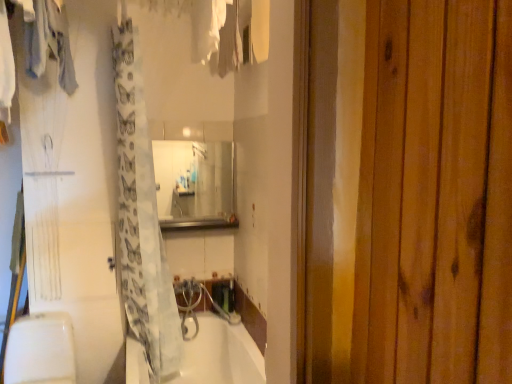
Question: Considering the relative sizes of metallic stainless steel at center and clear glass mirror at center in the image provided, is metallic stainless steel at center taller than clear glass mirror at center?

Choices:
 (A) yes
 (B) no

Answer: (B)

Question: Is metallic stainless steel at center behind clear glass mirror at center?

Choices:
 (A) no
 (B) yes

Answer: (A)

Question: Does metallic stainless steel at center have a lesser height compared to clear glass mirror at center?

Choices:
 (A) no
 (B) yes

Answer: (B)

Question: Could you tell me if metallic stainless steel at center is turned towards clear glass mirror at center?

Choices:
 (A) no
 (B) yes

Answer: (A)

Question: From a real-world perspective, is metallic stainless steel at center located higher than clear glass mirror at center?

Choices:
 (A) no
 (B) yes

Answer: (A)

Question: In the image, is translucent white shower curtain at center on the left side or the right side of white fabric at upper center, the second clothing in the left-to-right sequence?

Choices:
 (A) left
 (B) right

Answer: (A)

Question: From the image's perspective, is translucent white shower curtain at center above or below white fabric at upper center, which appears as the 1th clothing when viewed from the right?

Choices:
 (A) above
 (B) below

Answer: (B)

Question: Is translucent white shower curtain at center inside or outside of white fabric at upper center, which appears as the 1th clothing when viewed from the right?

Choices:
 (A) outside
 (B) inside

Answer: (A)

Question: In the image, is translucent white shower curtain at center positioned in front of or behind white fabric at upper center, the second clothing in the left-to-right sequence?

Choices:
 (A) behind
 (B) front

Answer: (A)

Question: Is metallic stainless steel at center spatially inside translucent white shower curtain at center, or outside of it?

Choices:
 (A) inside
 (B) outside

Answer: (B)

Question: Considering the positions of metallic stainless steel at center and translucent white shower curtain at center in the image, is metallic stainless steel at center wider or thinner than translucent white shower curtain at center?

Choices:
 (A) thin
 (B) wide

Answer: (A)

Question: From the image's perspective, is metallic stainless steel at center located above or below translucent white shower curtain at center?

Choices:
 (A) above
 (B) below

Answer: (B)

Question: In terms of size, does metallic stainless steel at center appear bigger or smaller than translucent white shower curtain at center?

Choices:
 (A) big
 (B) small

Answer: (B)

Question: Considering the positions of translucent white shower curtain at center and metallic stainless steel at center in the image, is translucent white shower curtain at center taller or shorter than metallic stainless steel at center?

Choices:
 (A) short
 (B) tall

Answer: (B)

Question: Considering their positions, is translucent white shower curtain at center located in front of or behind metallic stainless steel at center?

Choices:
 (A) front
 (B) behind

Answer: (A)